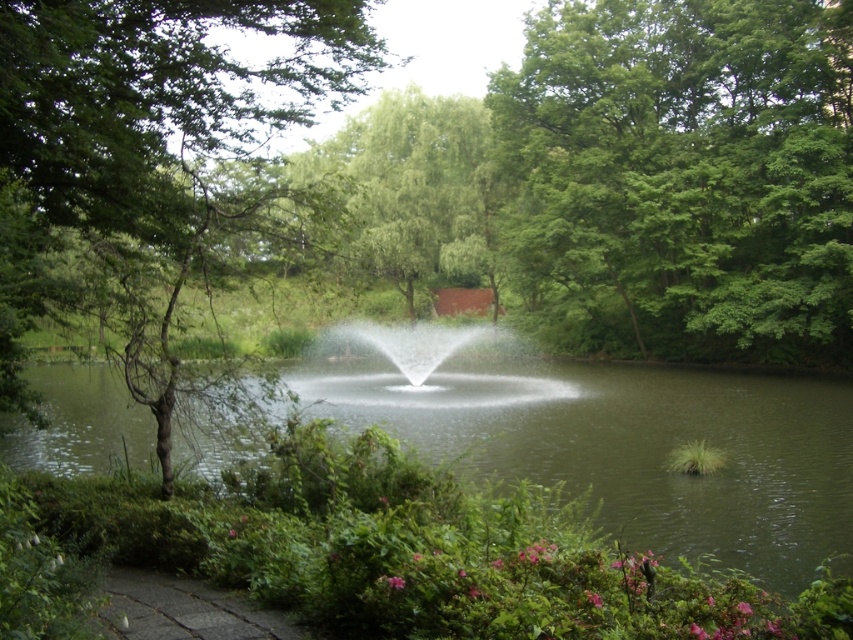
You are standing in the garden and want to take a photo of the clear water at center and the green leafy tree at center. Which object will appear smaller in the photo?

→ The clear water at center will appear smaller because it has a lesser height compared to the green leafy tree at center.

You are standing at the point closest to the bottom left corner of the garden. You want to walk towards the fountain in the pond. There are two points marked in the garden. One is at coordinate point [637,140] and the other is at coordinate point [38,60]. Which point should you avoid stepping on if you want to reach the fountain without crossing any obstacles?

You should avoid stepping on point [637,140] because it is behind point [38,60], meaning there might be an obstacle blocking the path towards the fountain.